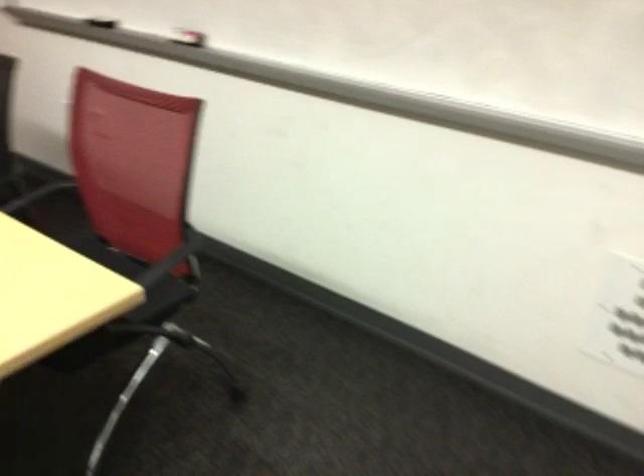
Question: The images are taken continuously from a first-person perspective. In which direction is your viewpoint rotating?

Choices:
 (A) Left
 (B) Right
 (C) Up
 (D) Down

Answer: (A)